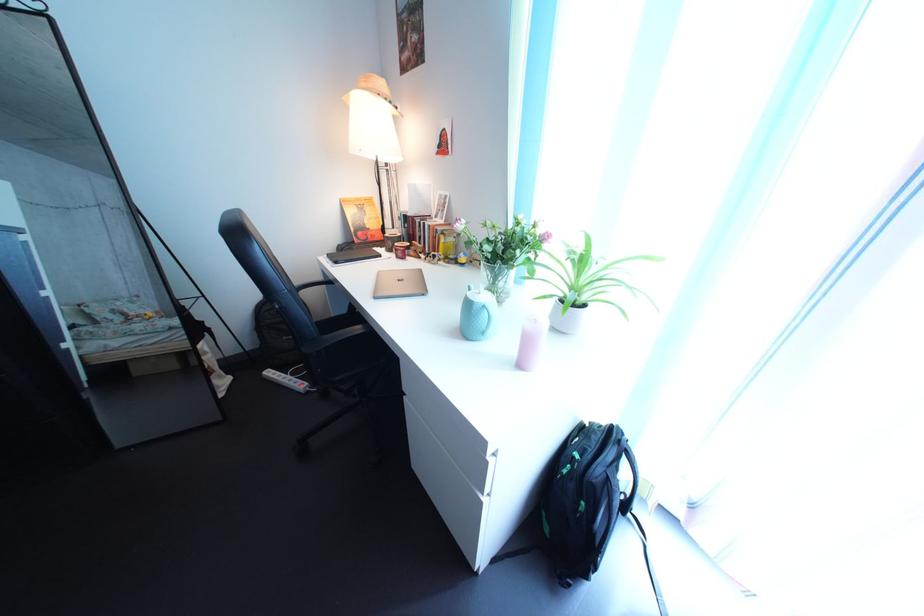
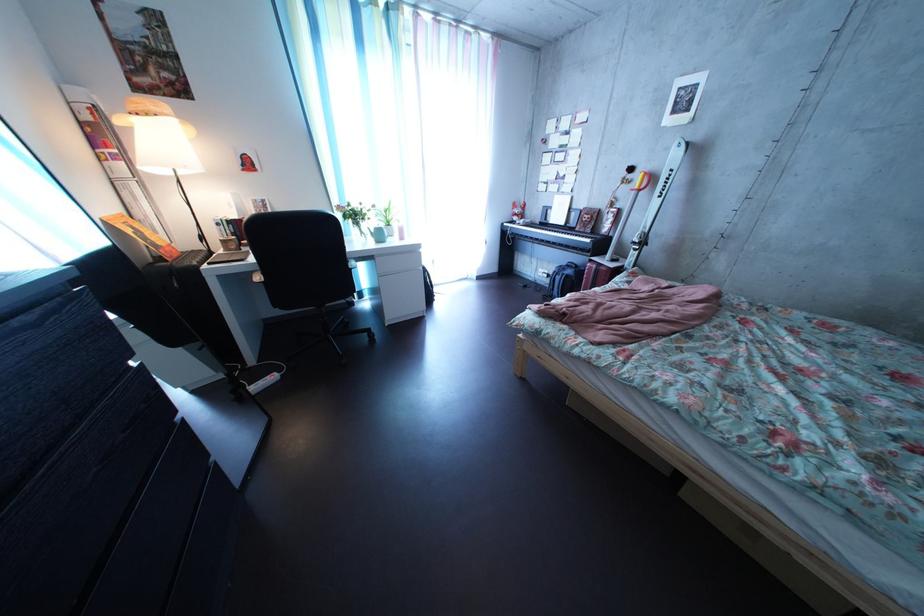
Question: I am providing you with two images of the same scene from different viewpoints. Please identify which objects are invisible in image2.

Choices:
 (A) black piano key
 (B) white teapot
 (C) backpack top handle
 (D) portable space heater

Answer: (C)